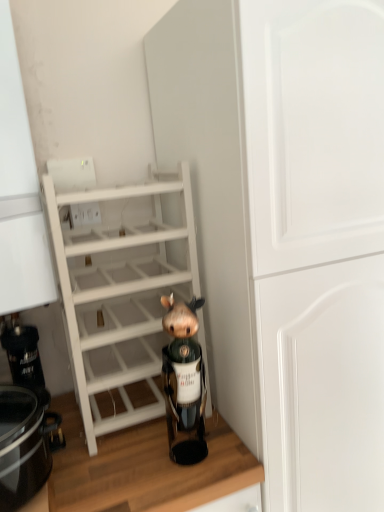
Question: From a real-world perspective, does brown matte figurine at center sit lower than black glossy crock pot at lower left?

Choices:
 (A) yes
 (B) no

Answer: (B)

Question: Is brown matte figurine at center further to the viewer compared to black glossy crock pot at lower left?

Choices:
 (A) yes
 (B) no

Answer: (A)

Question: From the image's perspective, does brown matte figurine at center appear higher than black glossy crock pot at lower left?

Choices:
 (A) no
 (B) yes

Answer: (B)

Question: Can you confirm if brown matte figurine at center is taller than black glossy crock pot at lower left?

Choices:
 (A) no
 (B) yes

Answer: (B)

Question: Is black glossy crock pot at lower left a part of brown matte figurine at center?

Choices:
 (A) yes
 (B) no

Answer: (B)

Question: In terms of width, does black glossy crock pot at lower left look wider or thinner when compared to wooden at lower center?

Choices:
 (A) wide
 (B) thin

Answer: (B)

Question: Is black glossy crock pot at lower left in front of or behind wooden at lower center in the image?

Choices:
 (A) front
 (B) behind

Answer: (A)

Question: From a real-world perspective, is black glossy crock pot at lower left physically located above or below wooden at lower center?

Choices:
 (A) above
 (B) below

Answer: (A)

Question: Is point (44, 428) positioned closer to the camera than point (145, 440)?

Choices:
 (A) closer
 (B) farther

Answer: (A)

Question: Considering the relative positions of white matte cabinet at center and brown matte figurine at center in the image provided, is white matte cabinet at center to the left or to the right of brown matte figurine at center?

Choices:
 (A) right
 (B) left

Answer: (A)

Question: Is white matte cabinet at center wider or thinner than brown matte figurine at center?

Choices:
 (A) thin
 (B) wide

Answer: (B)

Question: From the image's perspective, relative to brown matte figurine at center, is white matte cabinet at center above or below?

Choices:
 (A) below
 (B) above

Answer: (A)

Question: Choose the correct answer: Is white matte cabinet at center inside brown matte figurine at center or outside it?

Choices:
 (A) inside
 (B) outside

Answer: (B)

Question: Is wooden at lower center bigger or smaller than brown matte figurine at center?

Choices:
 (A) big
 (B) small

Answer: (A)

Question: In terms of width, does wooden at lower center look wider or thinner when compared to brown matte figurine at center?

Choices:
 (A) wide
 (B) thin

Answer: (A)